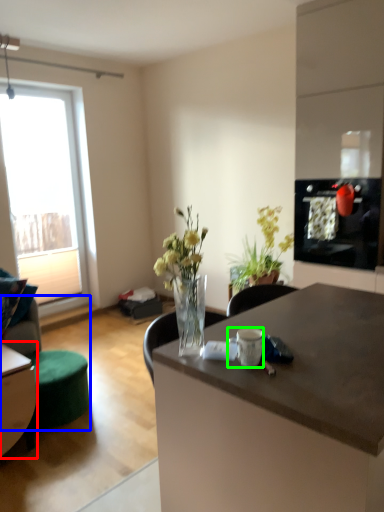
Question: Which object is the closest to the table (highlighted by a red box)? Choose among these: swivel chair (highlighted by a blue box) or coffee cup (highlighted by a green box).

Choices:
 (A) swivel chair
 (B) coffee cup

Answer: (A)